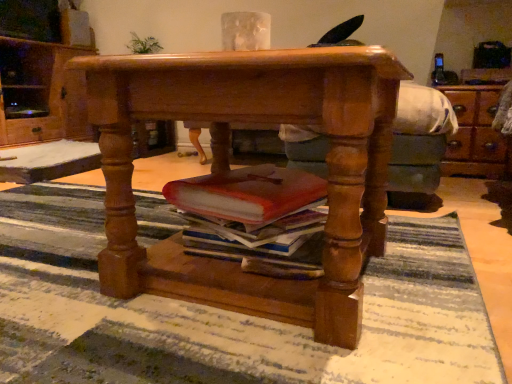
Question: Is green leafy plant at upper left further to camera compared to polished wood desk at center?

Choices:
 (A) no
 (B) yes

Answer: (B)

Question: Is green leafy plant at upper left looking in the opposite direction of polished wood desk at center?

Choices:
 (A) no
 (B) yes

Answer: (A)

Question: Considering the relative positions of green leafy plant at upper left and polished wood desk at center in the image provided, is green leafy plant at upper left in front of polished wood desk at center?

Choices:
 (A) yes
 (B) no

Answer: (B)

Question: Does green leafy plant at upper left have a lesser height compared to polished wood desk at center?

Choices:
 (A) no
 (B) yes

Answer: (B)

Question: From a real-world perspective, is green leafy plant at upper left over polished wood desk at center?

Choices:
 (A) no
 (B) yes

Answer: (B)

Question: Does point (328, 198) appear closer or farther from the camera than point (404, 370)?

Choices:
 (A) closer
 (B) farther

Answer: (B)

Question: From a real-world perspective, is polished wood desk at center physically located above or below striped rug at center?

Choices:
 (A) above
 (B) below

Answer: (A)

Question: Is polished wood desk at center spatially inside striped rug at center, or outside of it?

Choices:
 (A) inside
 (B) outside

Answer: (B)

Question: Based on their positions, is polished wood desk at center located to the left or right of striped rug at center?

Choices:
 (A) left
 (B) right

Answer: (B)

Question: Looking at their shapes, would you say green leafy plant at upper left is wider or thinner than striped rug at center?

Choices:
 (A) thin
 (B) wide

Answer: (A)

Question: Does point (144, 41) appear closer or farther from the camera than point (50, 241)?

Choices:
 (A) closer
 (B) farther

Answer: (B)

Question: Do you think green leafy plant at upper left is within striped rug at center, or outside of it?

Choices:
 (A) outside
 (B) inside

Answer: (A)

Question: In the image, is green leafy plant at upper left on the left side or the right side of striped rug at center?

Choices:
 (A) left
 (B) right

Answer: (A)

Question: Is polished wood desk at center inside or outside of wooden cabinet at left?

Choices:
 (A) inside
 (B) outside

Answer: (B)

Question: Relative to wooden cabinet at left, is polished wood desk at center in front or behind?

Choices:
 (A) behind
 (B) front

Answer: (B)